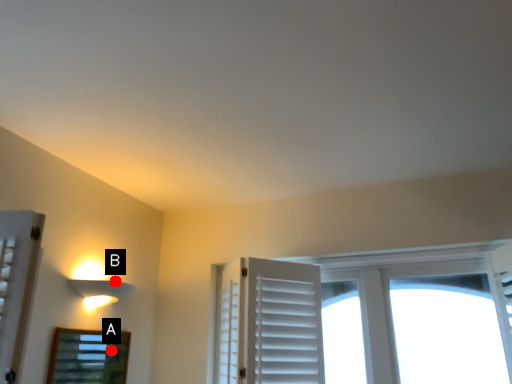
Question: Two points are circled on the image, labeled by A and B beside each circle. Which point is further to the camera?

Choices:
 (A) A is further
 (B) B is further

Answer: (B)